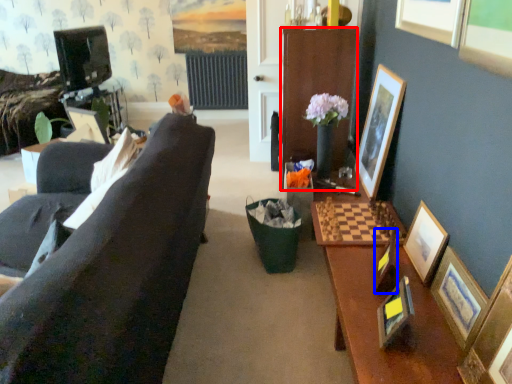
Question: Which object is further to the camera taking this photo, cabinetry (highlighted by a red box) or picture frame (highlighted by a blue box)?

Choices:
 (A) cabinetry
 (B) picture frame

Answer: (A)